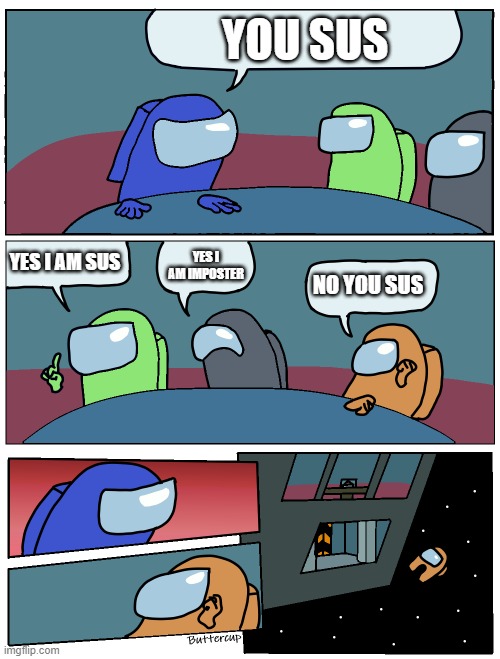
Identify the location of table. pyautogui.click(x=247, y=408), pyautogui.click(x=296, y=205).